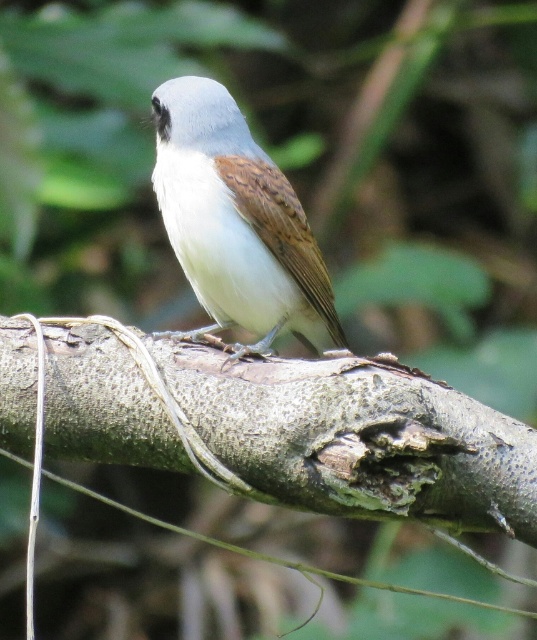
You are a birdwatcher observing the scene. You notice the rough bark branch at center and the white matte bird at center. Which object takes up more space in the image?

The rough bark branch at center is larger in size than the white matte bird at center, so it takes up more space in the image.

You are a birdwatcher trying to photograph the rough bark branch at center. Where exactly is the branch positioned in the image?

The rough bark branch at center is located at point (265,426) in the image coordinates.

You are an ornithologist observing the scene. You notice the rough bark branch at center and the white matte bird at center. Which object is located to the right of the other?

The rough bark branch at center is positioned on the right side of white matte bird at center, so the rough bark branch at center is to the right of the white matte bird at center.